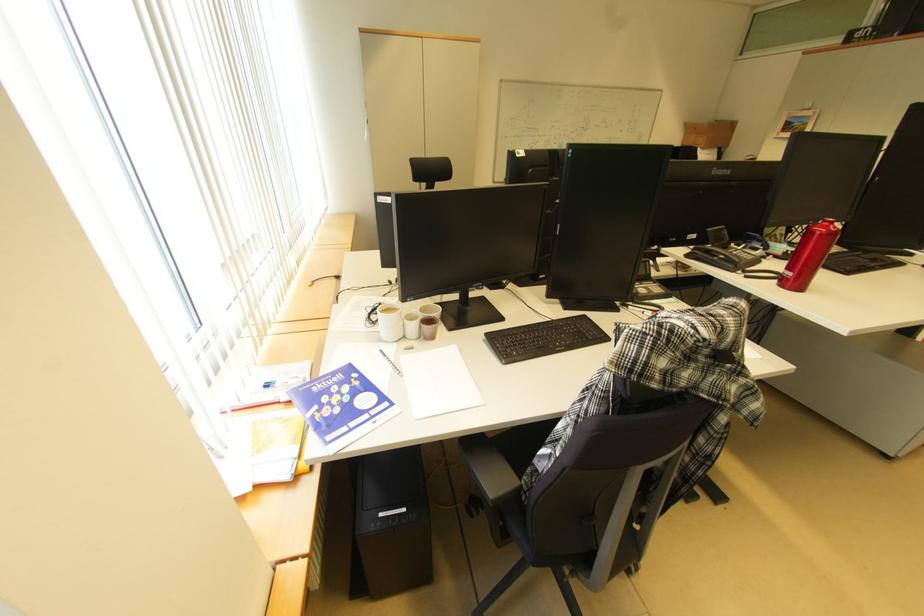
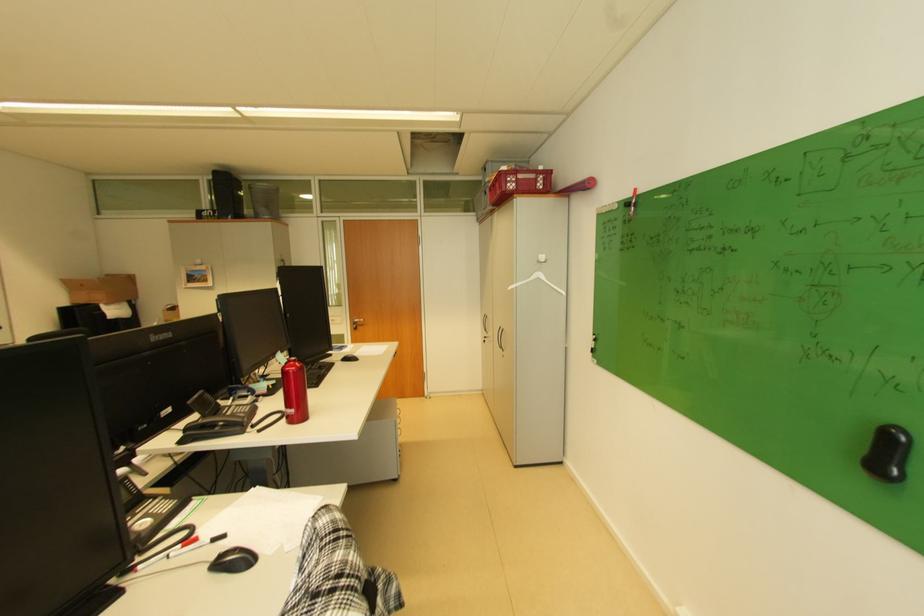
Where in the second image is the point corresponding to point 834,225 from the first image?

(301, 363)